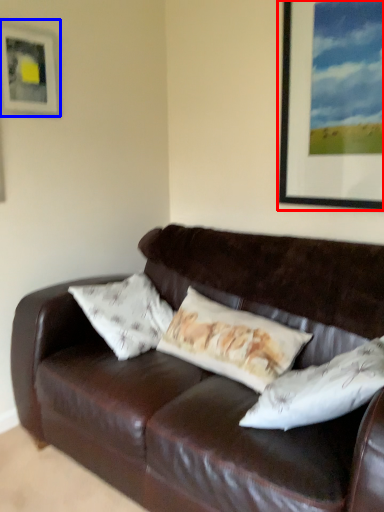
Question: Which object is further to the camera taking this photo, picture frame (highlighted by a red box) or picture frame (highlighted by a blue box)?

Choices:
 (A) picture frame
 (B) picture frame

Answer: (B)